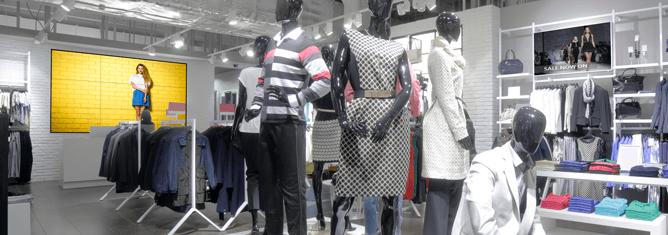
This screenshot has width=668, height=235. Identify the location of brick wall. (41, 117), (480, 65).